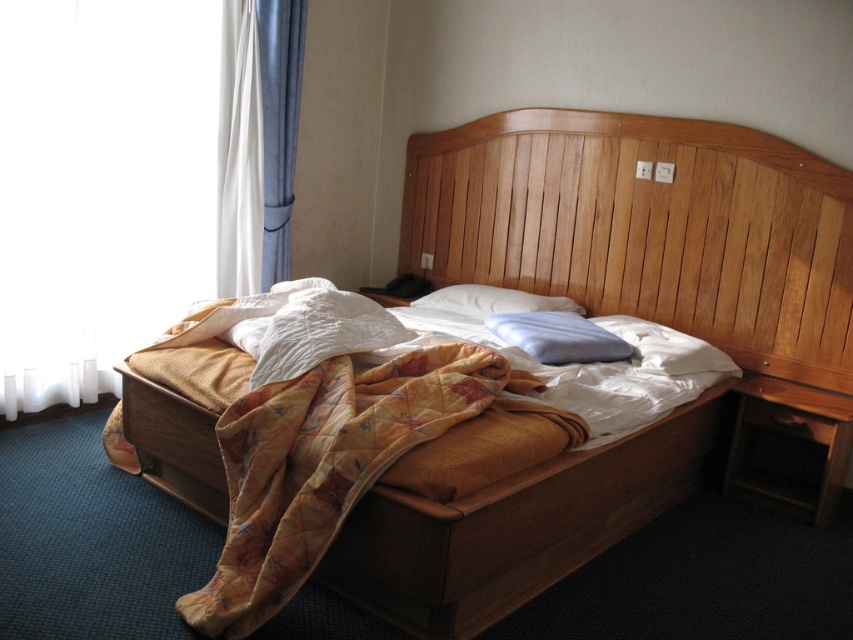
Question: Considering the real-world distances, which object is farthest from the white sheer curtain at upper left?

Choices:
 (A) white sheer curtain at left
 (B) quilted orange blanket at center

Answer: (B)

Question: Among these points, which one is nearest to the camera?

Choices:
 (A) (643, 182)
 (B) (283, 33)
 (C) (624, 342)
 (D) (514, 298)

Answer: (C)

Question: Is the position of wooden headboard at center more distant than that of white quilted fabric at center?

Choices:
 (A) no
 (B) yes

Answer: (B)

Question: Is white sheer curtain at left positioned behind blue velvet curtain at upper left?

Choices:
 (A) no
 (B) yes

Answer: (A)

Question: Which object is positioned closest to the white quilted fabric at center?

Choices:
 (A) white sheer curtain at upper left
 (B) blue soft pillow at center

Answer: (B)

Question: Is wooden headboard at center above white soft pillow at center?

Choices:
 (A) no
 (B) yes

Answer: (B)